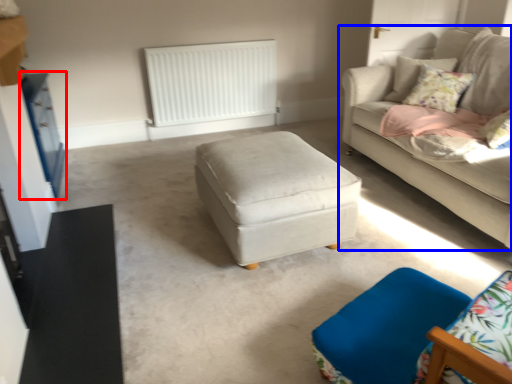
Question: Which of the following is the farthest to the observer, dresser (highlighted by a red box) or studio couch (highlighted by a blue box)?

Choices:
 (A) dresser
 (B) studio couch

Answer: (A)